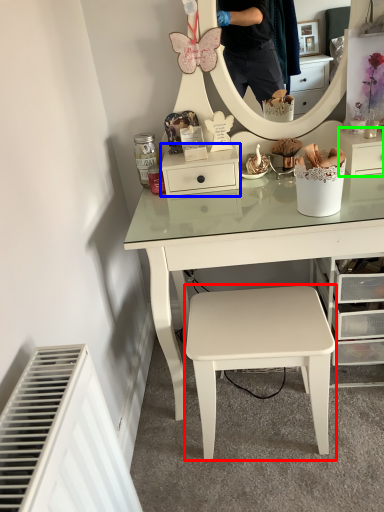
Question: Estimate the real-world distances between objects in this image. Which object is farther from stool (highlighted by a red box), shelf (highlighted by a blue box) or shelf (highlighted by a green box)?

Choices:
 (A) shelf
 (B) shelf

Answer: (B)